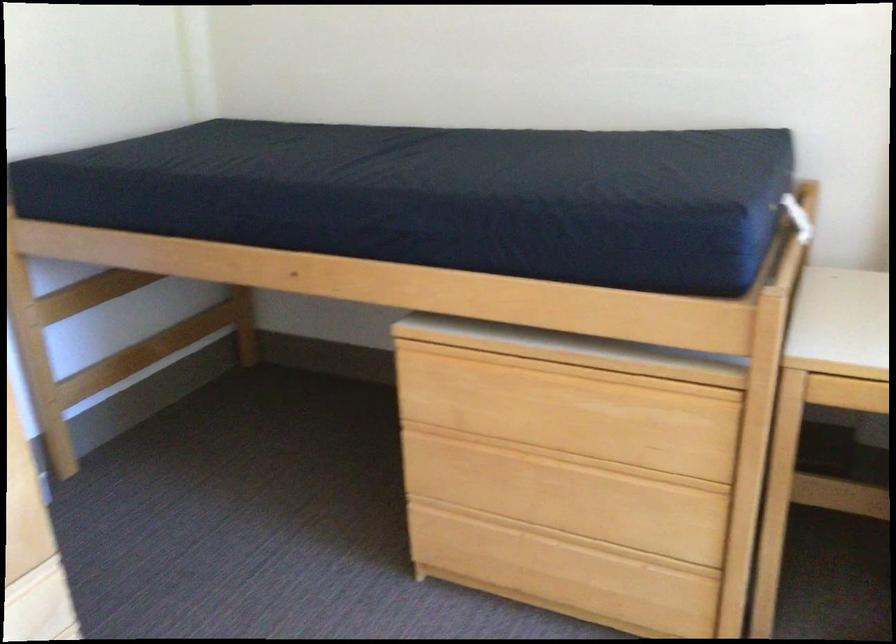
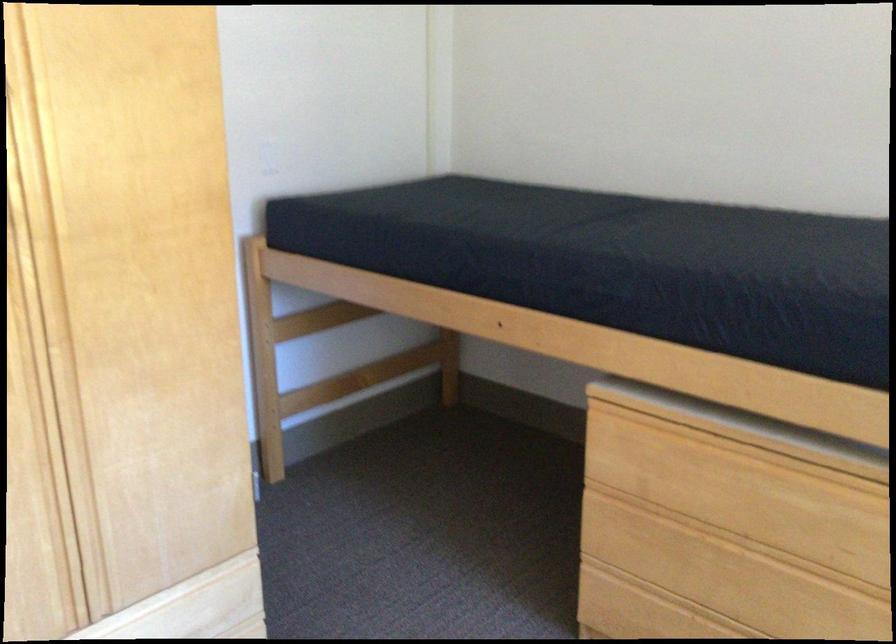
Find the pixel in the second image that matches point (538, 406) in the first image.

(728, 488)